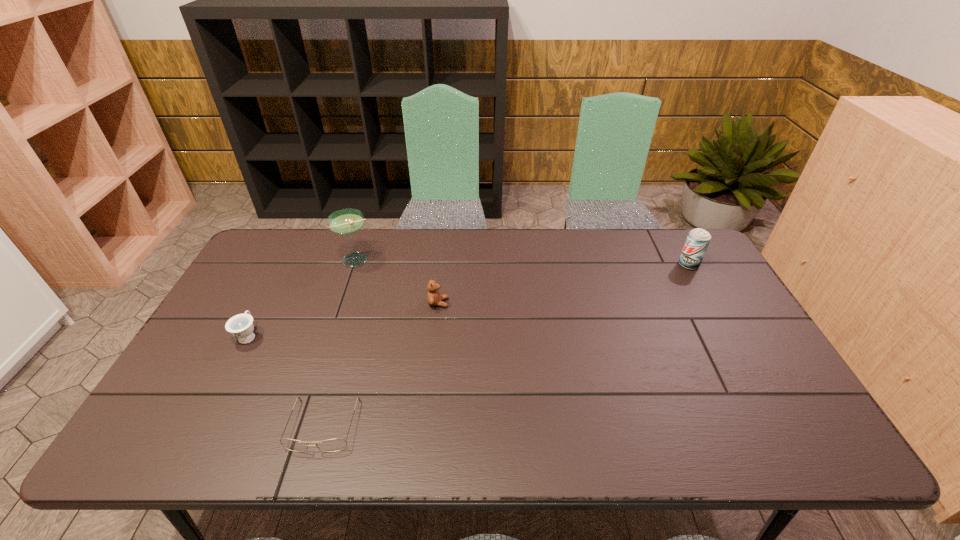
Find the location of `martini`. martini is located at coordinates (348, 221).

Where is `the fourth shortest object`? The height and width of the screenshot is (540, 960). the fourth shortest object is located at coordinates (698, 239).

You are a GUI agent. You are given a task and a screenshot of the screen. Output one action in this format:
    pyautogui.click(x=<x>, y=<y>)
    Task: Click on the beer can
    This screenshot has width=960, height=540.
    Given the screenshot: What is the action you would take?
    pyautogui.click(x=698, y=239)

Identify the location of the third shortest object. (434, 298).

Where is `the third farthest object`? the third farthest object is located at coordinates (434, 298).

The height and width of the screenshot is (540, 960). I want to click on the leftmost object, so click(x=241, y=326).

You are a GUI agent. You are given a task and a screenshot of the screen. Output one action in this format:
    pyautogui.click(x=<x>, y=<y>)
    Task: Click on the fourth farthest object
    Image resolution: width=960 pixels, height=540 pixels.
    Given the screenshot: What is the action you would take?
    pyautogui.click(x=241, y=326)

Find the location of a particular element. This screenshot has width=960, height=540. the nearest object is located at coordinates (331, 445).

Find the location of a particular element. The image size is (960, 540). the shortest object is located at coordinates (331, 445).

You are a GUI agent. You are given a task and a screenshot of the screen. Output one action in this format:
    pyautogui.click(x=<x>, y=<y>)
    Task: Click on the vacant area situated on the right of the martini
    The image size is (960, 540).
    Given the screenshot: What is the action you would take?
    pyautogui.click(x=473, y=260)